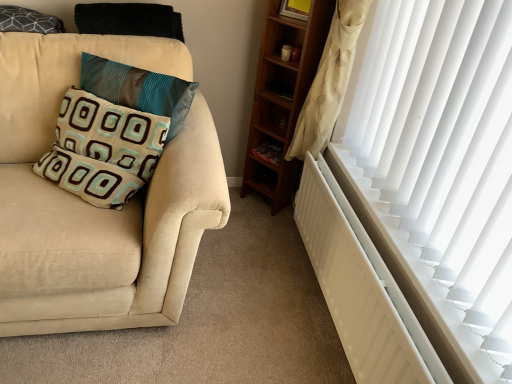
How much space does dark gray textured pillow at upper left, the 3th pillow when ordered from bottom to top, occupy horizontally?

dark gray textured pillow at upper left, the 3th pillow when ordered from bottom to top, is 6.54 inches wide.

The image size is (512, 384). Find the location of `white matte radiator at right`. white matte radiator at right is located at coordinates (360, 287).

Consider the image. Considering the sizes of objects beige fabric pillow at left, the third pillow in the top-to-bottom sequence, and suede beige couch at left in the image provided, who is shorter, beige fabric pillow at left, the third pillow in the top-to-bottom sequence, or suede beige couch at left?

Standing shorter between the two is beige fabric pillow at left, the third pillow in the top-to-bottom sequence.

Can you tell me how much beige fabric pillow at left, which is the first pillow in bottom-to-top order, and suede beige couch at left differ in facing direction?

The angular difference between beige fabric pillow at left, which is the first pillow in bottom-to-top order, and suede beige couch at left is 36.5 degrees.

Is beige fabric pillow at left, the third pillow in the top-to-bottom sequence, behind suede beige couch at left?

Yes, it is behind suede beige couch at left.

Does beige fabric pillow at left, which is the first pillow in bottom-to-top order, have a larger size compared to suede beige couch at left?

Incorrect, beige fabric pillow at left, which is the first pillow in bottom-to-top order, is not larger than suede beige couch at left.

Would you say white matte radiator at right is a long distance from dark gray textured pillow at upper left, the 3th pillow when ordered from bottom to top?

Yes, white matte radiator at right and dark gray textured pillow at upper left, the 3th pillow when ordered from bottom to top, are quite far apart.

Which object is thinner, white matte radiator at right or dark gray textured pillow at upper left, which ranks as the first pillow in top-to-bottom order?

white matte radiator at right.

Does white matte radiator at right have a larger size compared to dark gray textured pillow at upper left, the 3th pillow when ordered from bottom to top?

Yes.

Between white matte radiator at right and dark gray textured pillow at upper left, the 3th pillow when ordered from bottom to top, which one appears on the left side from the viewer's perspective?

Positioned to the left is dark gray textured pillow at upper left, the 3th pillow when ordered from bottom to top.

In the scene shown: Considering the relative sizes of wooden bookshelf at center and suede beige couch at left in the image provided, is wooden bookshelf at center smaller than suede beige couch at left?

Yes.

How distant is wooden bookshelf at center from suede beige couch at left?

They are 36.56 inches apart.

Can you confirm if wooden bookshelf at center is thinner than suede beige couch at left?

Correct, the width of wooden bookshelf at center is less than that of suede beige couch at left.

Is wooden bookshelf at center at the right side of suede beige couch at left?

Correct, you'll find wooden bookshelf at center to the right of suede beige couch at left.

Could you tell me if beige fabric pillow at left, which is the first pillow in bottom-to-top order, is turned towards wooden bookshelf at center?

No, beige fabric pillow at left, which is the first pillow in bottom-to-top order, is not aimed at wooden bookshelf at center.

Which of these two, beige fabric pillow at left, which is the first pillow in bottom-to-top order, or wooden bookshelf at center, is bigger?

With larger size is beige fabric pillow at left, which is the first pillow in bottom-to-top order.

From the image's perspective, which one is positioned lower, beige fabric pillow at left, which is the first pillow in bottom-to-top order, or wooden bookshelf at center?

beige fabric pillow at left, which is the first pillow in bottom-to-top order, is shown below in the image.

How different are the orientations of dark gray textured pillow at upper left, the 3th pillow when ordered from bottom to top, and white matte radiator at right in degrees?

89.8 degrees separate the facing orientations of dark gray textured pillow at upper left, the 3th pillow when ordered from bottom to top, and white matte radiator at right.

Is dark gray textured pillow at upper left, which ranks as the first pillow in top-to-bottom order, positioned with its back to white matte radiator at right?

No, white matte radiator at right is not at the back of dark gray textured pillow at upper left, which ranks as the first pillow in top-to-bottom order.

Consider the image. Which point is more distant from viewer, (5, 16) or (323, 181)?

Point (323, 181)

Does dark gray textured pillow at upper left, the 3th pillow when ordered from bottom to top, have a smaller size compared to white matte radiator at right?

Correct, dark gray textured pillow at upper left, the 3th pillow when ordered from bottom to top, occupies less space than white matte radiator at right.

Where is `pillow above the teal fabric pillow at left, the second pillow when ordered from bottom to top (from a real-world perspective)`? pillow above the teal fabric pillow at left, the second pillow when ordered from bottom to top (from a real-world perspective) is located at coordinates (28, 21).

From a real-world perspective, is dark gray textured pillow at upper left, which ranks as the first pillow in top-to-bottom order, physically above teal fabric pillow at left, the second pillow when ordered from bottom to top?

Yes, from a real-world perspective, dark gray textured pillow at upper left, which ranks as the first pillow in top-to-bottom order, is over teal fabric pillow at left, the second pillow when ordered from bottom to top

Can you confirm if dark gray textured pillow at upper left, the 3th pillow when ordered from bottom to top, is smaller than teal fabric pillow at left, the second pillow when ordered from bottom to top?

Correct, dark gray textured pillow at upper left, the 3th pillow when ordered from bottom to top, occupies less space than teal fabric pillow at left, the second pillow when ordered from bottom to top.

Which is behind, point (17, 9) or point (96, 61)?

Positioned behind is point (17, 9).

Which of these two, beige fabric pillow at left, which is the first pillow in bottom-to-top order, or dark gray textured pillow at upper left, the 3th pillow when ordered from bottom to top, is thinner?

dark gray textured pillow at upper left, the 3th pillow when ordered from bottom to top.

Are beige fabric pillow at left, which is the first pillow in bottom-to-top order, and dark gray textured pillow at upper left, which ranks as the first pillow in top-to-bottom order, beside each other?

beige fabric pillow at left, which is the first pillow in bottom-to-top order, and dark gray textured pillow at upper left, which ranks as the first pillow in top-to-bottom order, are not in contact.

Would you say beige fabric pillow at left, which is the first pillow in bottom-to-top order, is to the left or to the right of dark gray textured pillow at upper left, which ranks as the first pillow in top-to-bottom order, in the picture?

beige fabric pillow at left, which is the first pillow in bottom-to-top order, is positioned on dark gray textured pillow at upper left, which ranks as the first pillow in top-to-bottom order,'s right side.

Looking at this image, from a real-world perspective, is beige fabric pillow at left, the third pillow in the top-to-bottom sequence, physically above dark gray textured pillow at upper left, which ranks as the first pillow in top-to-bottom order?

Actually, beige fabric pillow at left, the third pillow in the top-to-bottom sequence, is physically below dark gray textured pillow at upper left, which ranks as the first pillow in top-to-bottom order, in the real world.

From a real-world perspective, count 1st pillows upward from the suede beige couch at left and point to it. Please provide its 2D coordinates.

[(103, 149)]

In order to click on radiator that appears below the dark gray textured pillow at upper left, which ranks as the first pillow in top-to-bottom order (from the image's perspective) in this screenshot , I will do `click(360, 287)`.

Looking at the image, which one is located further to white matte radiator at right, teal fabric pillow at left, which is the second pillow in top-to-bottom order, or wooden bookshelf at center?

teal fabric pillow at left, which is the second pillow in top-to-bottom order, lies further to white matte radiator at right than the other object.

Considering their positions, is beige fabric pillow at left, which is the first pillow in bottom-to-top order, positioned closer to white matte radiator at right than suede beige couch at left?

suede beige couch at left lies closer to white matte radiator at right than the other object.

Considering their positions, is white matte radiator at right positioned closer to dark gray textured pillow at upper left, the 3th pillow when ordered from bottom to top, than teal fabric pillow at left, the second pillow when ordered from bottom to top?

teal fabric pillow at left, the second pillow when ordered from bottom to top, lies closer to dark gray textured pillow at upper left, the 3th pillow when ordered from bottom to top, than the other object.

Which object lies further to the anchor point wooden bookshelf at center, dark gray textured pillow at upper left, which ranks as the first pillow in top-to-bottom order, or beige fabric pillow at left, the third pillow in the top-to-bottom sequence?

dark gray textured pillow at upper left, which ranks as the first pillow in top-to-bottom order, is further to wooden bookshelf at center.

From the image, which object appears to be nearer to suede beige couch at left, white matte radiator at right or dark gray textured pillow at upper left, which ranks as the first pillow in top-to-bottom order?

Based on the image, dark gray textured pillow at upper left, which ranks as the first pillow in top-to-bottom order, appears to be nearer to suede beige couch at left.

When comparing their distances from white matte radiator at right, does teal fabric pillow at left, the second pillow when ordered from bottom to top, or beige fabric pillow at left, the third pillow in the top-to-bottom sequence, seem further?

beige fabric pillow at left, the third pillow in the top-to-bottom sequence.

Looking at the image, which one is located closer to teal fabric pillow at left, the second pillow when ordered from bottom to top, dark gray textured pillow at upper left, which ranks as the first pillow in top-to-bottom order, or suede beige couch at left?

suede beige couch at left is positioned closer to the anchor teal fabric pillow at left, the second pillow when ordered from bottom to top.

Estimate the real-world distances between objects in this image. Which object is further from wooden bookshelf at center, beige fabric pillow at left, the third pillow in the top-to-bottom sequence, or dark gray textured pillow at upper left, the 3th pillow when ordered from bottom to top?

Based on the image, dark gray textured pillow at upper left, the 3th pillow when ordered from bottom to top, appears to be further to wooden bookshelf at center.

Locate an element on the screen. shelf between dark gray textured pillow at upper left, which ranks as the first pillow in top-to-bottom order, and white matte radiator at right, in the horizontal direction is located at coordinates (267, 149).

Where is `studio couch between dark gray textured pillow at upper left, which ranks as the first pillow in top-to-bottom order, and white matte radiator at right`? The image size is (512, 384). studio couch between dark gray textured pillow at upper left, which ranks as the first pillow in top-to-bottom order, and white matte radiator at right is located at coordinates (97, 208).

Locate an element on the screen. The height and width of the screenshot is (384, 512). radiator between suede beige couch at left and wooden bookshelf at center along the z-axis is located at coordinates (360, 287).

Find the location of `pillow between dark gray textured pillow at upper left, the 3th pillow when ordered from bottom to top, and teal fabric pillow at left, which is the second pillow in top-to-bottom order, from left to right`. pillow between dark gray textured pillow at upper left, the 3th pillow when ordered from bottom to top, and teal fabric pillow at left, which is the second pillow in top-to-bottom order, from left to right is located at coordinates (103, 149).